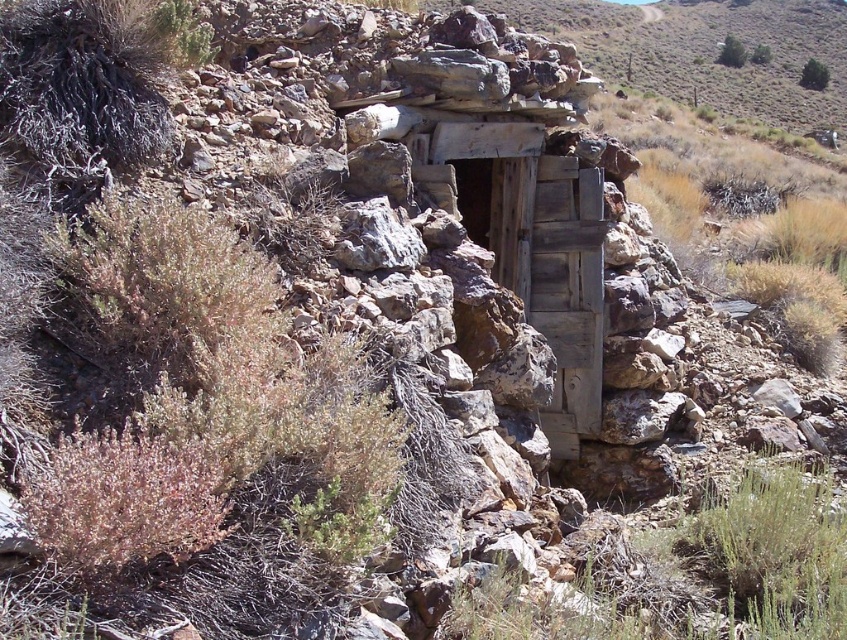
Question: Can you confirm if green leafy shrub at upper right is thinner than green leafy shrub at upper center?

Choices:
 (A) no
 (B) yes

Answer: (A)

Question: Can you confirm if green leafy shrub at upper right is wider than green leafy shrub at upper center?

Choices:
 (A) yes
 (B) no

Answer: (A)

Question: Estimate the real-world distances between objects in this image. Which object is farther from the green leafy bush at upper right?

Choices:
 (A) green leafy shrub at upper right
 (B) green leafy shrub at upper center

Answer: (A)

Question: Which of the following is the closest to the observer?

Choices:
 (A) (759, 54)
 (B) (720, 49)
 (C) (817, 67)

Answer: (C)

Question: Does green leafy shrub at upper right have a greater width compared to green leafy shrub at upper center?

Choices:
 (A) no
 (B) yes

Answer: (B)

Question: Which object is positioned farthest from the green leafy bush at upper right?

Choices:
 (A) green leafy shrub at upper right
 (B) green leafy shrub at upper center

Answer: (A)